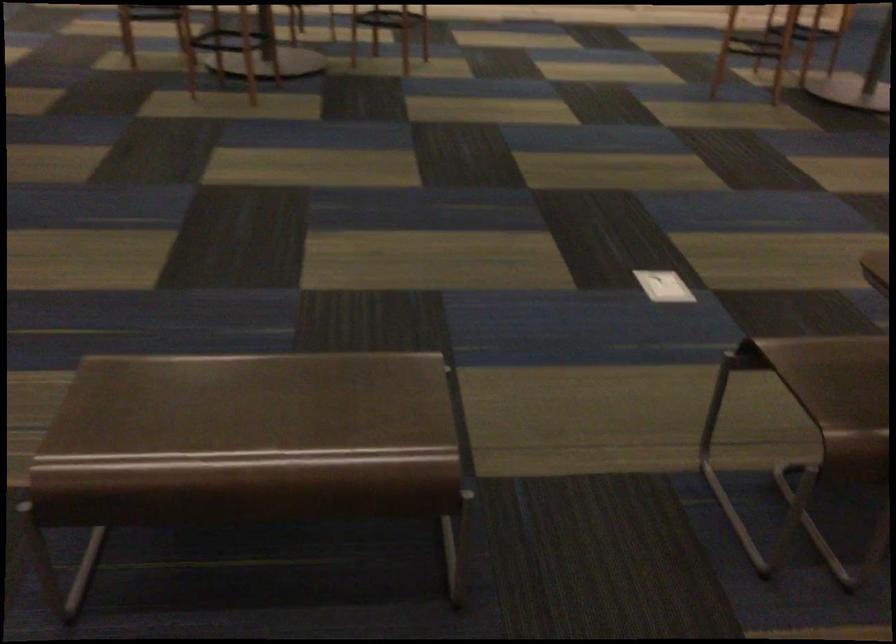
The location [664,286] corresponds to which object?

It refers to a white paper on floor.